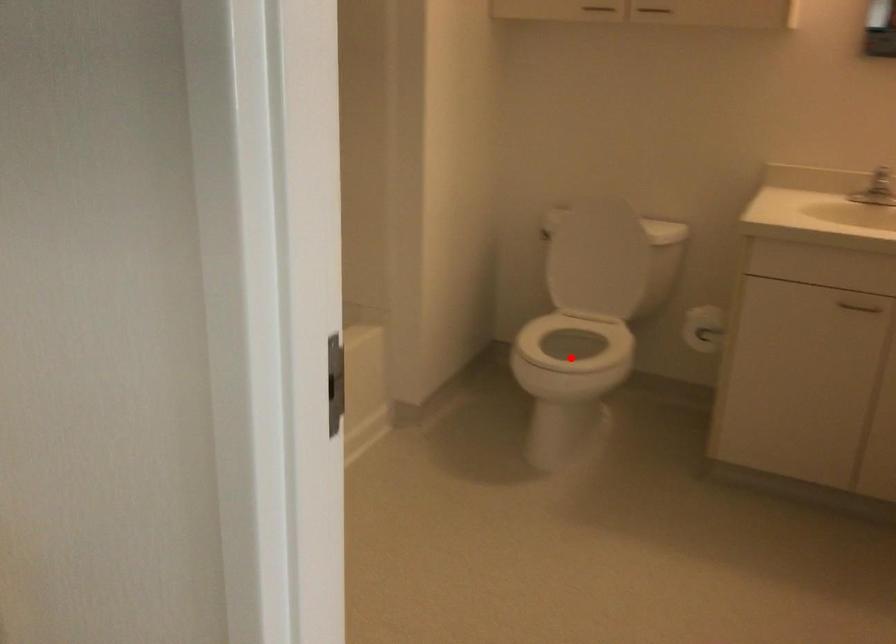
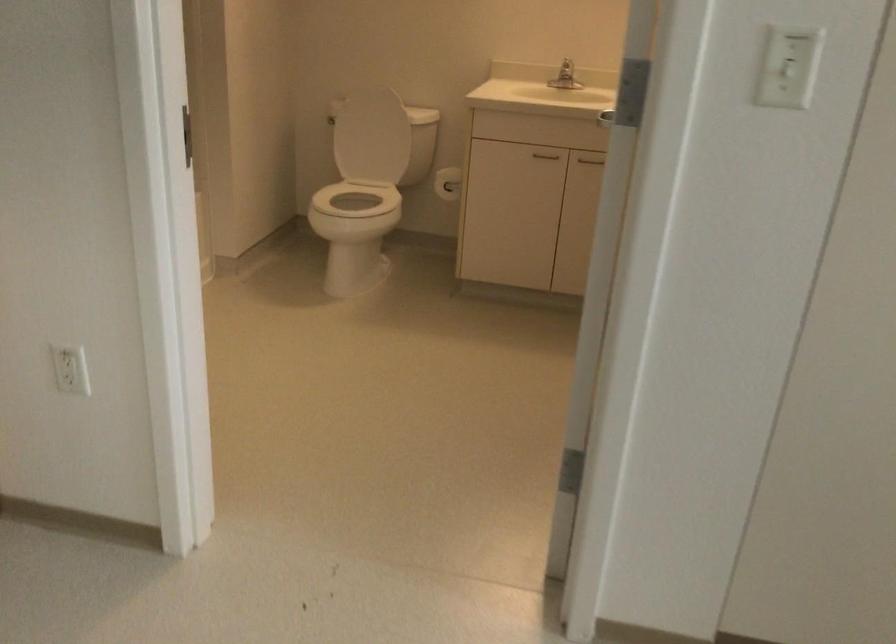
Question: I am providing you with two images of the same scene from different viewpoints. A red point is marked on the first image. Is the red point's position out of view in image 2?

Choices:
 (A) Yes
 (B) No

Answer: (A)